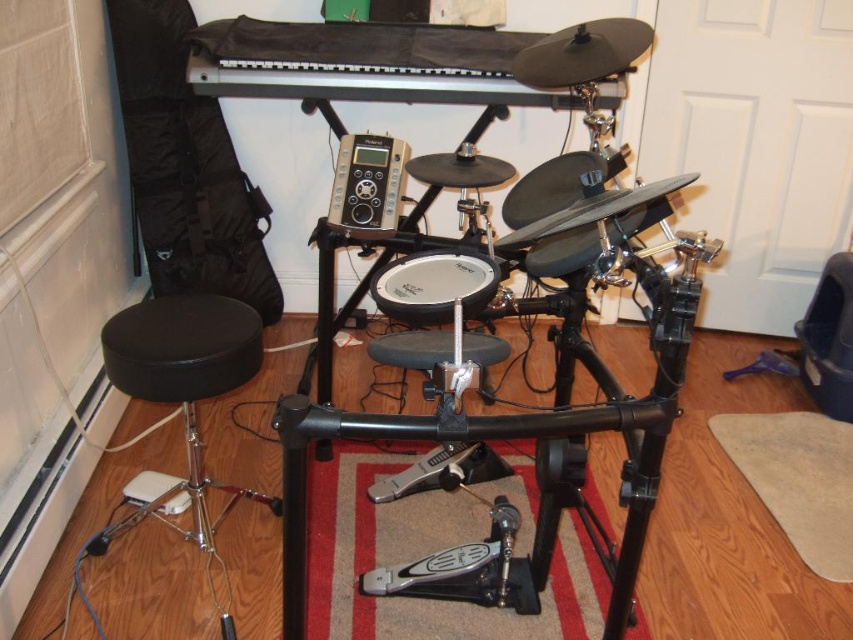
Question: Which is nearer to the black matte keyboard at upper center?

Choices:
 (A) white matte drum at center
 (B) silver metallic speaker at center
 (C) black leather stool at lower left

Answer: (B)

Question: Among these objects, which one is nearest to the camera?

Choices:
 (A) black matte keyboard at upper center
 (B) black leather stool at lower left
 (C) silver metallic speaker at center

Answer: (B)

Question: Does black matte keyboard at upper center have a greater width compared to white matte drum at center?

Choices:
 (A) yes
 (B) no

Answer: (A)

Question: Which point is closer to the camera?

Choices:
 (A) (119, 340)
 (B) (403, 72)
 (C) (363, 186)
 (D) (402, 296)

Answer: (D)

Question: Does black matte keyboard at upper center have a smaller size compared to silver metallic speaker at center?

Choices:
 (A) no
 (B) yes

Answer: (A)

Question: Does black matte keyboard at upper center have a smaller size compared to white matte drum at center?

Choices:
 (A) no
 (B) yes

Answer: (A)